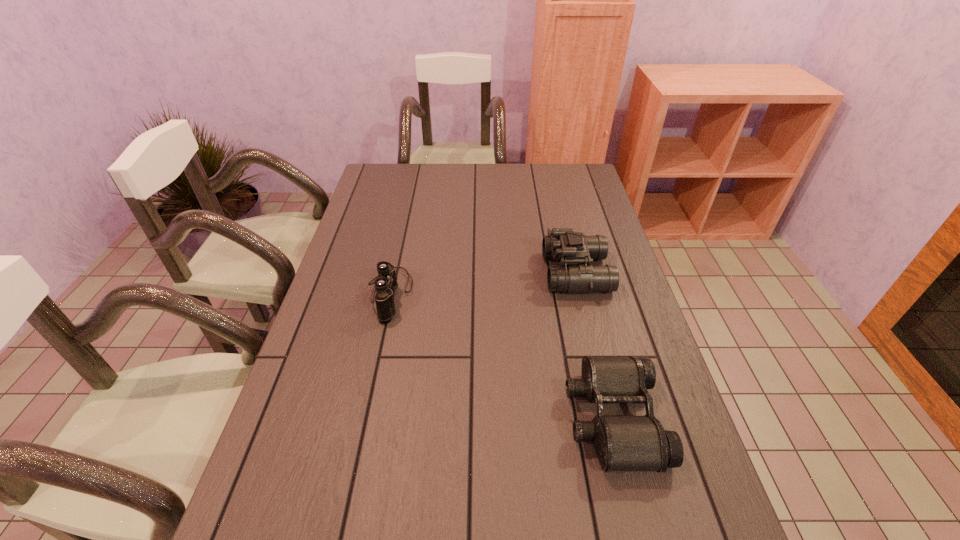
Find the location of a particular element. This screenshot has height=540, width=960. the tallest binoculars is located at coordinates (563, 244).

Identify the location of the second shortest object. (386, 283).

Identify the location of the second shortest binoculars. (386, 283).

The width and height of the screenshot is (960, 540). In order to click on the shortest binoculars in this screenshot , I will do click(x=622, y=443).

Locate an element on the screen. The width and height of the screenshot is (960, 540). the shortest object is located at coordinates (622, 443).

This screenshot has height=540, width=960. In order to click on free space located 0.230m through the lenses of the tallest binoculars in this screenshot , I will do `click(468, 273)`.

Where is `vacant space located 0.250m through the lenses of the tallest binoculars`? vacant space located 0.250m through the lenses of the tallest binoculars is located at coordinates (462, 273).

This screenshot has height=540, width=960. What are the coordinates of `free space located through the lenses of the tallest binoculars` in the screenshot? It's located at (448, 273).

Where is `vacant space located on the left of the second tallest object`? The image size is (960, 540). vacant space located on the left of the second tallest object is located at coordinates (340, 294).

Image resolution: width=960 pixels, height=540 pixels. I want to click on free region located 0.310m through the eyepieces of the shortest object, so click(427, 418).